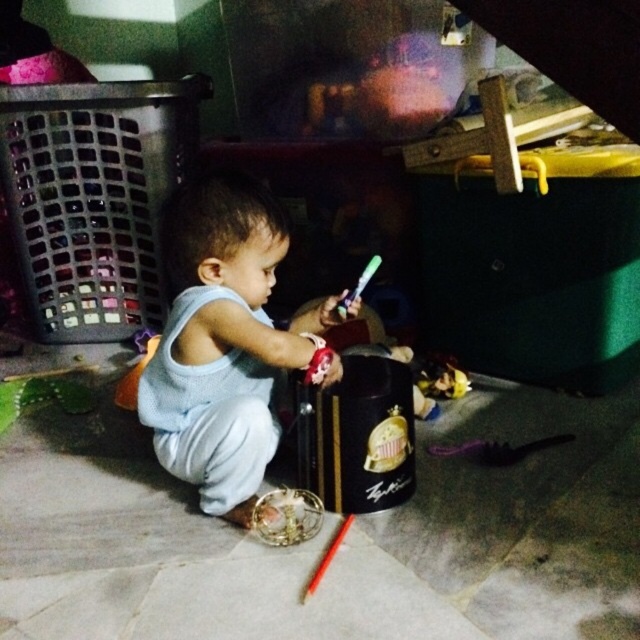
Question: Is light blue fabric toddler at center closer to camera compared to red wooden paint brush at lower center?

Choices:
 (A) no
 (B) yes

Answer: (A)

Question: Which of the following is the closest to the observer?

Choices:
 (A) (x=273, y=257)
 (B) (x=308, y=592)

Answer: (B)

Question: Does light blue fabric toddler at center appear on the right side of red wooden paint brush at lower center?

Choices:
 (A) yes
 (B) no

Answer: (B)

Question: Among these objects, which one is farthest from the camera?

Choices:
 (A) red wooden paint brush at lower center
 (B) light blue fabric toddler at center

Answer: (B)

Question: Can you confirm if light blue fabric toddler at center is positioned to the left of red wooden paint brush at lower center?

Choices:
 (A) no
 (B) yes

Answer: (B)